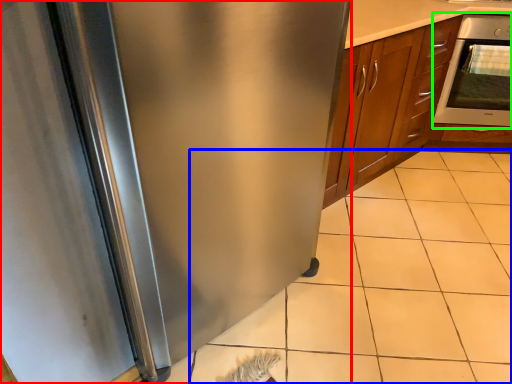
Question: Estimate the real-world distances between objects in this image. Which object is closer to refrigerator (highlighted by a red box), tile (highlighted by a blue box) or oven (highlighted by a green box)?

Choices:
 (A) tile
 (B) oven

Answer: (A)